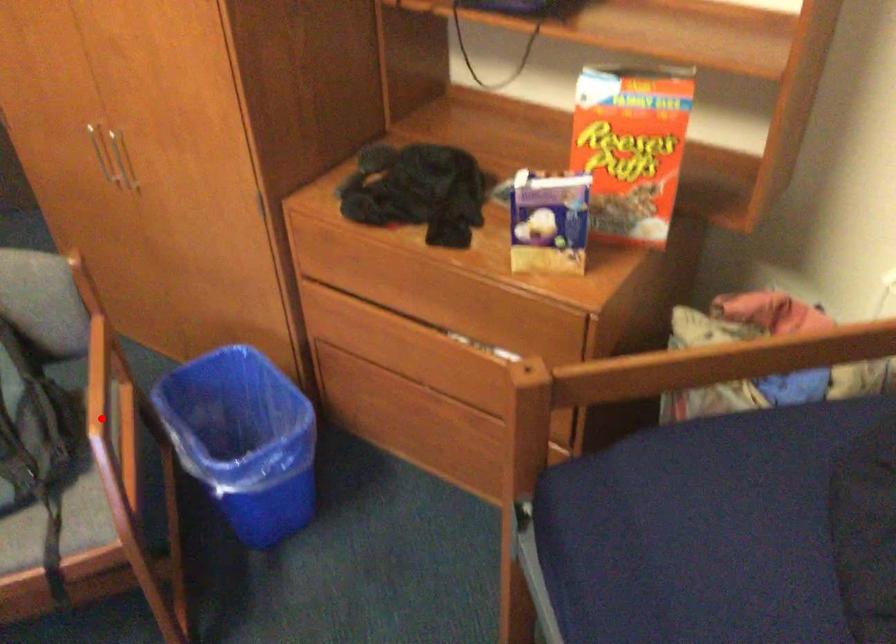
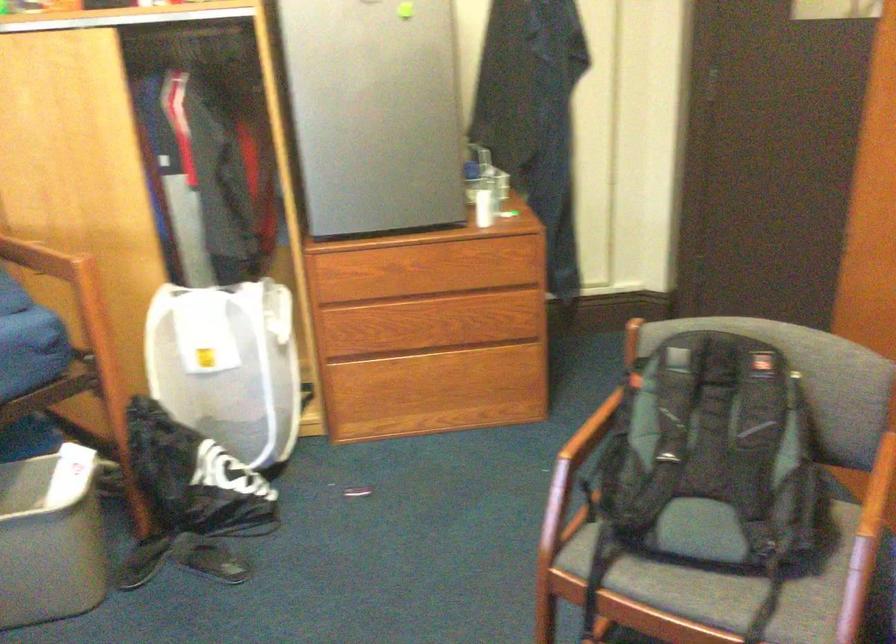
Where in the second image is the point corresponding to the highlighted location from the first image?

(871, 520)